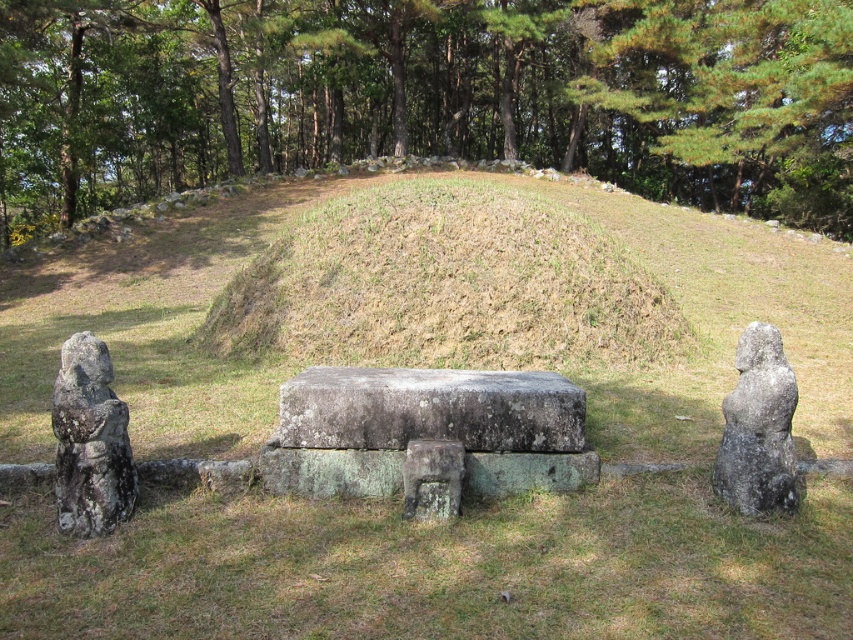
Question: Which object is closer to the camera taking this photo?

Choices:
 (A) brown grassy mound at center
 (B) rusty stone statue at left

Answer: (B)

Question: Does brown grassy mound at center appear over gray/weathered stone at center?

Choices:
 (A) no
 (B) yes

Answer: (B)

Question: Based on their relative distances, which object is farther from the gray/weathered stone at center?

Choices:
 (A) brown grassy mound at center
 (B) rusty stone statue at left
 (C) green leafy tree at upper center
 (D) green leafy trees at upper center

Answer: (D)

Question: Is brown grassy mound at center wider than rusty stone statue at left?

Choices:
 (A) no
 (B) yes

Answer: (B)

Question: Which of the following is the farthest from the observer?

Choices:
 (A) brown grassy mound at center
 (B) green leafy trees at upper center
 (C) rusty stone statue at left
 (D) gray/weathered stone at center

Answer: (B)

Question: Does gray/weathered stone at center appear on the right side of rusty stone statue at left?

Choices:
 (A) yes
 (B) no

Answer: (A)